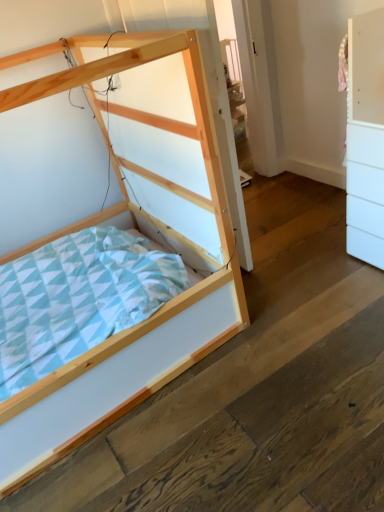
In order to face natural wood bed at left, should I rotate leftwards or rightwards?

To align with it, rotate left about 19.311°.

What do you see at coordinates (141, 231) in the screenshot? The image size is (384, 512). I see `natural wood bed at left` at bounding box center [141, 231].

Where is `natural wood bed at left`? natural wood bed at left is located at coordinates (141, 231).

Find the location of a particular element. natural wood bed at left is located at coordinates (141, 231).